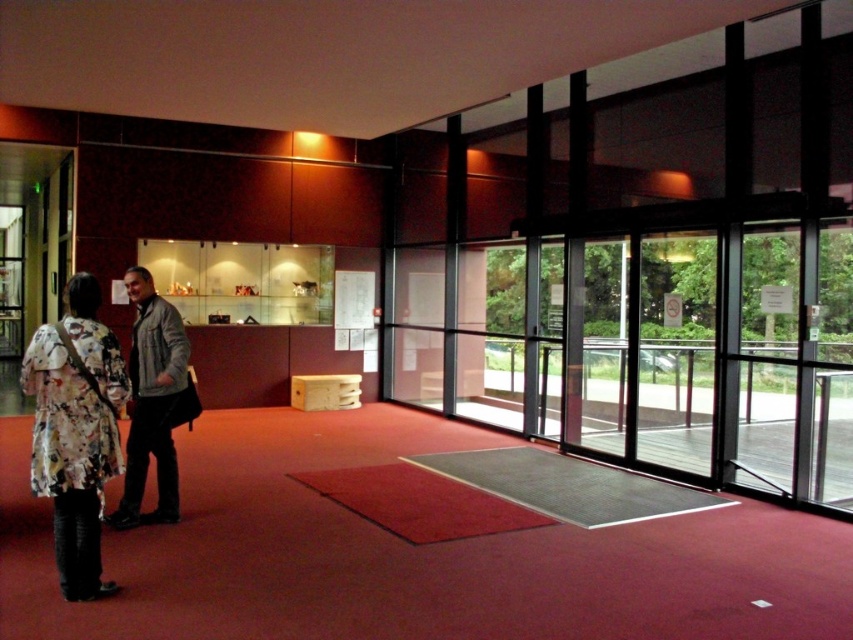
Which is below, floral fabric dress at left or gray fabric jacket at center?

Positioned lower is floral fabric dress at left.

Describe the element at coordinates (74, 432) in the screenshot. I see `floral fabric dress at left` at that location.

You are a GUI agent. You are given a task and a screenshot of the screen. Output one action in this format:
    pyautogui.click(x=<x>, y=<y>)
    Task: Click on the floral fabric dress at left
    This screenshot has height=640, width=853.
    Given the screenshot: What is the action you would take?
    (74, 432)

Where is `floral fabric dress at left`? floral fabric dress at left is located at coordinates (74, 432).